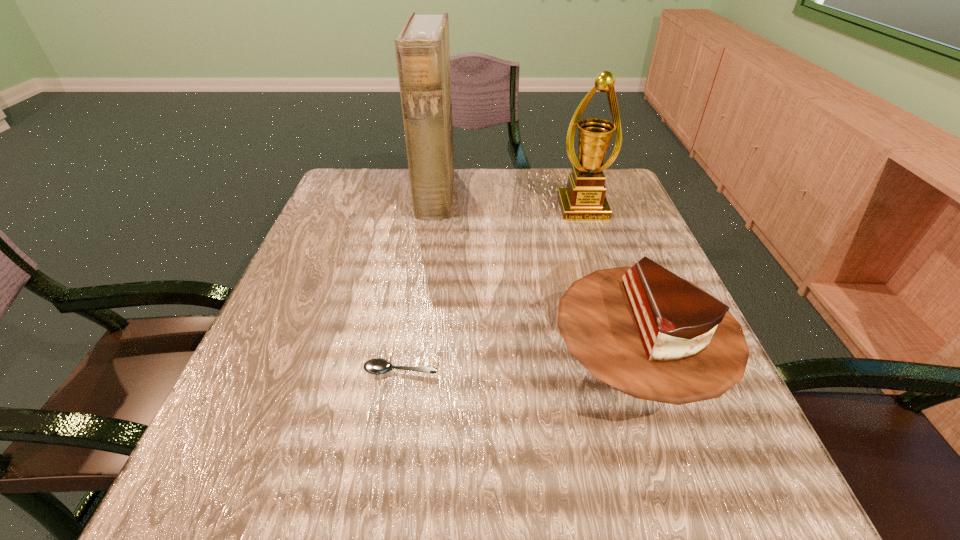
Where is `phonebook`? The width and height of the screenshot is (960, 540). phonebook is located at coordinates (422, 48).

You are a GUI agent. You are given a task and a screenshot of the screen. Output one action in this format:
    pyautogui.click(x=<x>, y=<y>)
    Task: Click on the award
    This screenshot has width=960, height=540.
    Given the screenshot: What is the action you would take?
    [584, 199]

This screenshot has width=960, height=540. What are the coordinates of `cake` in the screenshot? It's located at click(645, 331).

At what (x,y) coordinates should I click in order to perform the action: click on the shortest object. Please return your answer as a coordinate pair (x, y). Looking at the image, I should click on (377, 366).

Locate an element on the screen. The image size is (960, 540). vacant area situated 0.150m on the cover of the tallest object is located at coordinates (513, 194).

Find the location of a particular element. Image resolution: width=960 pixels, height=540 pixels. free space located 0.060m on the front-facing side of the third shortest object is located at coordinates (591, 237).

Where is `free space located 0.300m on the back of the cake`? free space located 0.300m on the back of the cake is located at coordinates (585, 217).

Identify the location of free space located on the right of the soupspoon. The image size is (960, 540). (509, 369).

Where is `phonebook located in the far edge section of the desktop`? The height and width of the screenshot is (540, 960). phonebook located in the far edge section of the desktop is located at coordinates (422, 48).

Find the location of `award that is positioned at the far edge`. award that is positioned at the far edge is located at coordinates (584, 199).